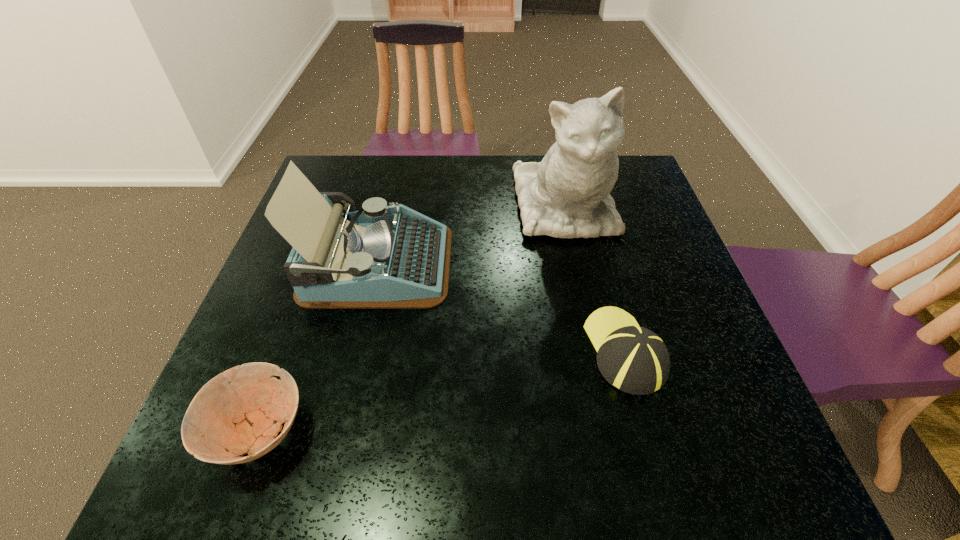
Image resolution: width=960 pixels, height=540 pixels. Identify the location of the tallest object. (567, 194).

Where is `typewriter`? The height and width of the screenshot is (540, 960). typewriter is located at coordinates (381, 257).

Where is `baseball cap`? Image resolution: width=960 pixels, height=540 pixels. baseball cap is located at coordinates (634, 359).

Find the location of a particular element. The height and width of the screenshot is (540, 960). bowl is located at coordinates (236, 411).

This screenshot has width=960, height=540. Find the location of `vacant space located 0.280m on the front-facing side of the tallest object`. vacant space located 0.280m on the front-facing side of the tallest object is located at coordinates (596, 352).

Find the location of `vacant space located on the typing side of the typewriter`. vacant space located on the typing side of the typewriter is located at coordinates (606, 264).

Where is `vacant area situated with the brim of the baseball cap facing forward`? The image size is (960, 540). vacant area situated with the brim of the baseball cap facing forward is located at coordinates (591, 228).

I want to click on free region located with the brim of the baseball cap facing forward, so [590, 225].

Image resolution: width=960 pixels, height=540 pixels. I want to click on free space located 0.250m with the brim of the baseball cap facing forward, so click(593, 235).

The width and height of the screenshot is (960, 540). Identify the location of free space located 0.330m on the right of the bowl. (500, 430).